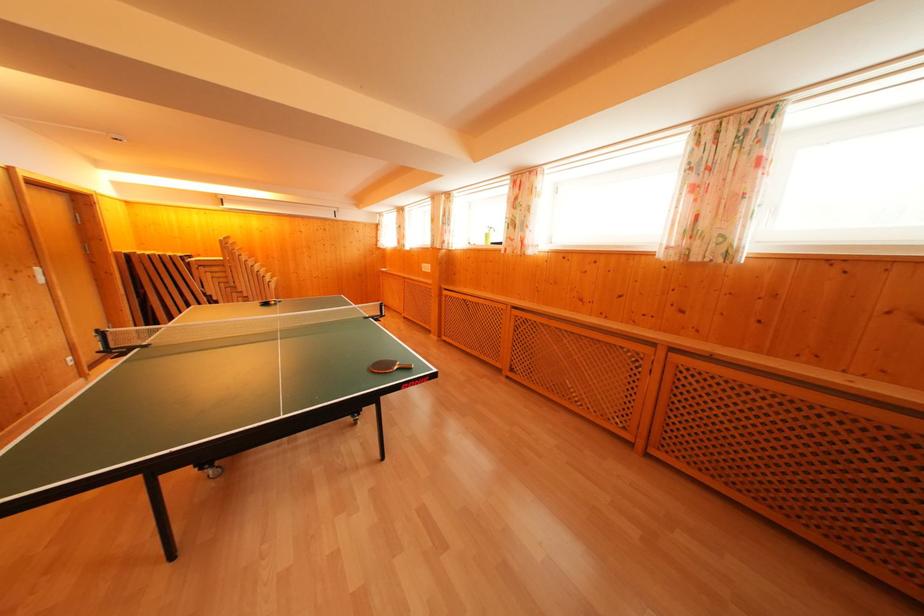
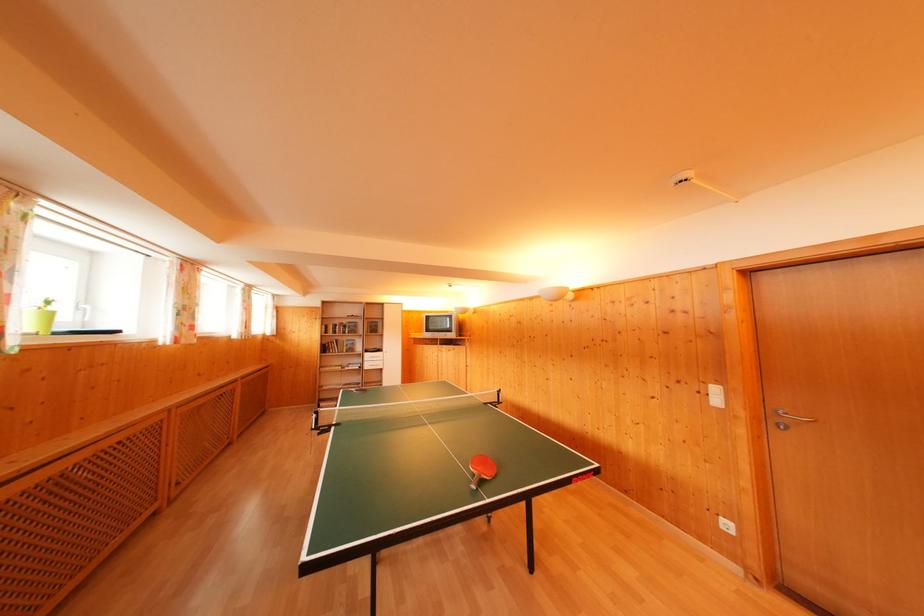
Locate, in the second image, the point that corresponds to (x=43, y=276) in the first image.

(721, 395)